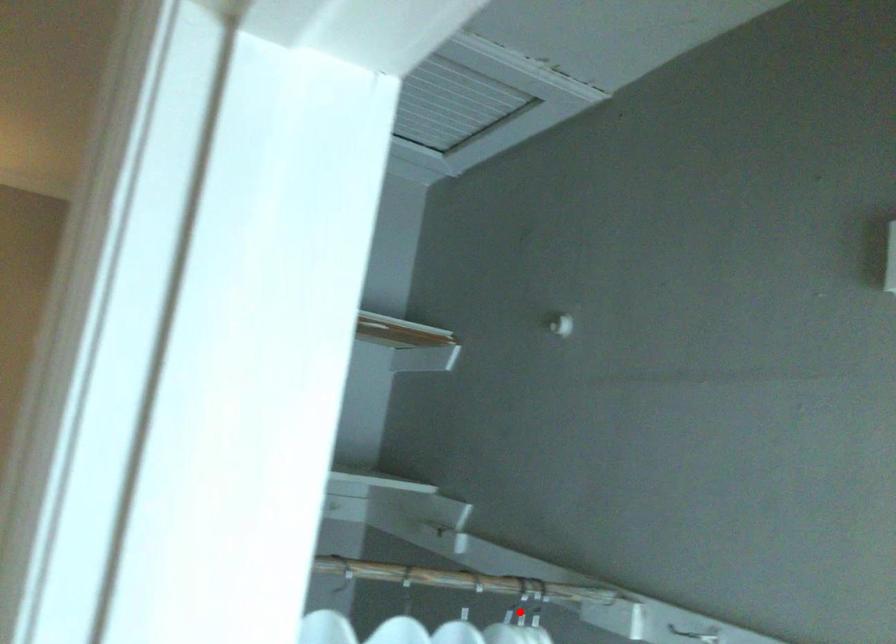
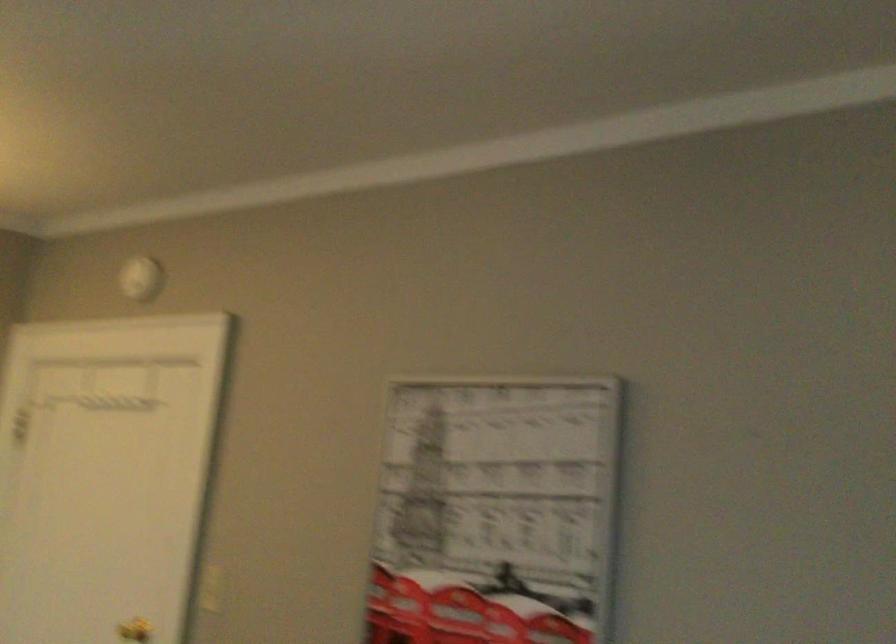
Question: I am providing you with two images of the same scene from different viewpoints. A red point is marked on the first image. Is the red point's position out of view in image 2?

Choices:
 (A) Yes
 (B) No

Answer: (A)